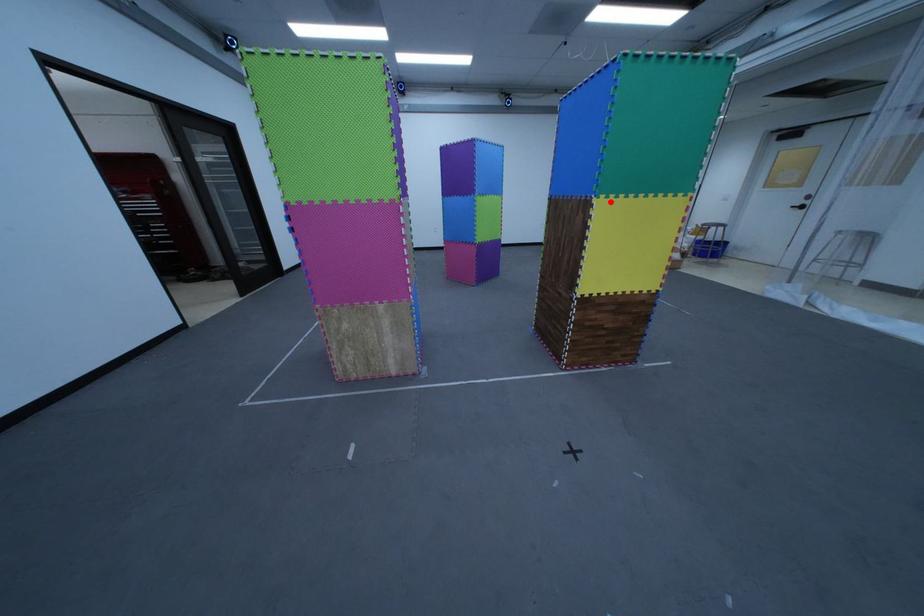
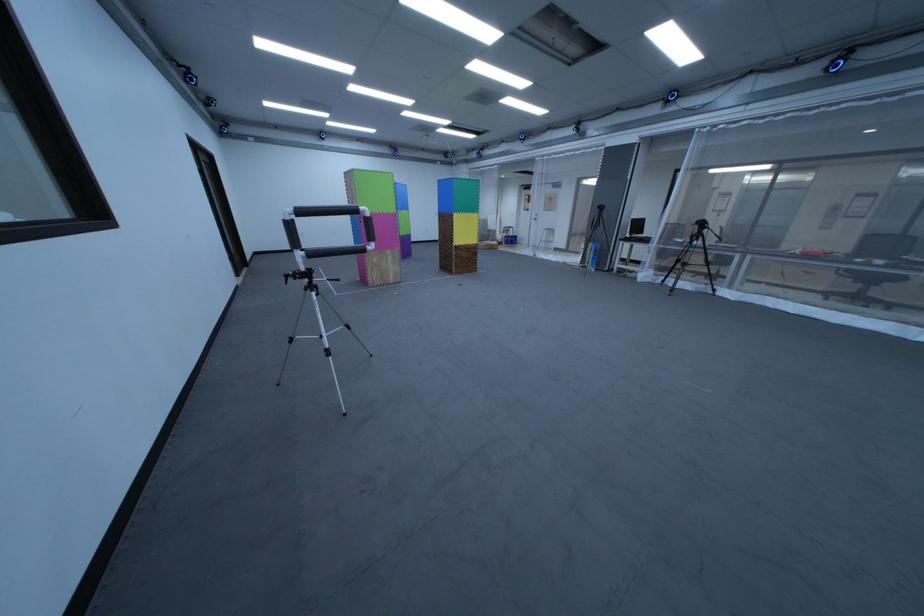
In the second image, find the point that corresponds to the highlighted location in the first image.

(469, 216)